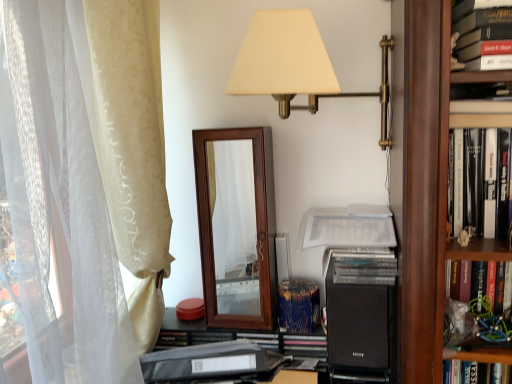
What do you see at coordinates (244, 338) in the screenshot? The width and height of the screenshot is (512, 384). I see `black plastic folder at lower center` at bounding box center [244, 338].

Identify the location of beige satin curtain at left. (85, 175).

The width and height of the screenshot is (512, 384). What do you see at coordinates (85, 175) in the screenshot? I see `beige satin curtain at left` at bounding box center [85, 175].

Find the location of a particular element. This screenshot has width=512, height=384. white paper at center is located at coordinates (347, 227).

Find the location of a particular element. The width and height of the screenshot is (512, 384). speaker below the hardcover book at right, the second book when ordered from top to bottom (from a real-world perspective) is located at coordinates [x=360, y=328].

From the image's perspective, which one is positioned higher, hardcover book at right, which is counted as the 1th book, starting from the bottom, or black matte speaker at center?

hardcover book at right, which is counted as the 1th book, starting from the bottom, appears higher in the image.

Considering the positions of objects hardcover book at right, the second book when ordered from top to bottom, and black matte speaker at center in the image provided, who is in front, hardcover book at right, the second book when ordered from top to bottom, or black matte speaker at center?

hardcover book at right, the second book when ordered from top to bottom, is more forward.

How different are the orientations of hardcover book at right, marked as the second book in a front-to-back arrangement, and black matte speaker at center in degrees?

There is a 2.75-degree angle between the facing directions of hardcover book at right, marked as the second book in a front-to-back arrangement, and black matte speaker at center.

Between wooden mirror at center and hardcover book at upper right, placed as the first book when sorted from top to bottom, which one has larger width?

Wider between the two is wooden mirror at center.

Can you tell me how much wooden mirror at center and hardcover book at upper right, placed as the first book when sorted from top to bottom, differ in facing direction?

The facing directions of wooden mirror at center and hardcover book at upper right, placed as the first book when sorted from top to bottom, are 1.38 degrees apart.

From the picture: Considering the relative sizes of wooden mirror at center and hardcover book at upper right, the second book in the bottom-to-top sequence, in the image provided, is wooden mirror at center shorter than hardcover book at upper right, the second book in the bottom-to-top sequence,?

Incorrect, the height of wooden mirror at center does not fall short of that of hardcover book at upper right, the second book in the bottom-to-top sequence.

Does wooden mirror at center lie in front of hardcover book at upper right, marked as the first book in a front-to-back arrangement?

No, it is behind hardcover book at upper right, marked as the first book in a front-to-back arrangement.

Looking at this image, which object is wider, hardcover book at upper right, the 2th book viewed from the back, or hardcover book at right, marked as the second book in a front-to-back arrangement?

A: hardcover book at right, marked as the second book in a front-to-back arrangement.

Based on their sizes in the image, would you say hardcover book at upper right, placed as the first book when sorted from top to bottom, is bigger or smaller than hardcover book at right, the second book when ordered from top to bottom?

In the image, hardcover book at upper right, placed as the first book when sorted from top to bottom, appears to be larger than hardcover book at right, the second book when ordered from top to bottom.

Consider the image. Considering the relative positions of hardcover book at upper right, the 2th book viewed from the back, and hardcover book at right, which is counted as the 1th book, starting from the bottom, in the image provided, is hardcover book at upper right, the 2th book viewed from the back, in front of hardcover book at right, which is counted as the 1th book, starting from the bottom,?

Yes, hardcover book at upper right, the 2th book viewed from the back, is in front of hardcover book at right, which is counted as the 1th book, starting from the bottom.

Can you confirm if hardcover book at upper right, placed as the first book when sorted from top to bottom, is taller than hardcover book at right, the second book when ordered from top to bottom?

Correct, hardcover book at upper right, placed as the first book when sorted from top to bottom, is much taller as hardcover book at right, the second book when ordered from top to bottom.

Is beige satin curtain at left not within wooden mirror at center?

Yes, beige satin curtain at left is located beyond the bounds of wooden mirror at center.

What's the angular difference between beige satin curtain at left and wooden mirror at center's facing directions?

There is a 96.7-degree angle between the facing directions of beige satin curtain at left and wooden mirror at center.

Is there a large distance between beige satin curtain at left and wooden mirror at center?

They are positioned close to each other.

From a real-world perspective, is wooden mirror at center located beneath beige satin curtain at left?

Yes, from a real-world perspective, wooden mirror at center is under beige satin curtain at left.

In the scene shown: Is wooden mirror at center positioned in front of beige satin curtain at left?

No, wooden mirror at center is behind beige satin curtain at left.

Does wooden mirror at center have a larger size compared to beige satin curtain at left?

No.

Identify the location of mirror on the right of beige satin curtain at left. The height and width of the screenshot is (384, 512). (237, 226).

From a real-world perspective, is white paper at center positioned under wooden mirror at center based on gravity?

No, from a real-world perspective, white paper at center is not under wooden mirror at center.

Is white paper at center facing towards wooden mirror at center?

No, white paper at center is not turned towards wooden mirror at center.

Does white paper at center have a greater height compared to wooden mirror at center?

No.

From the image's perspective, is white paper at center above beige satin curtain at left?

No.

Based on the photo, what's the angular difference between white paper at center and beige satin curtain at left's facing directions?

The angle between the facing direction of white paper at center and the facing direction of beige satin curtain at left is 97.3 degrees.

Who is more distant, white paper at center or beige satin curtain at left?

white paper at center is more distant.

In the image, there is a hardcover book at right, which is counted as the 1th book, starting from the bottom. Where is `speaker below it (from the image's perspective)`? This screenshot has height=384, width=512. speaker below it (from the image's perspective) is located at coordinates (360, 328).

Find the location of a particular element. The width and height of the screenshot is (512, 384). mirror located on the left of hardcover book at upper right, placed as the first book when sorted from top to bottom is located at coordinates (237, 226).

Looking at this image, when comparing their distances from black matte speaker at center, does black plastic folder at lower center or white paper at center seem closer?

white paper at center is closer to black matte speaker at center.

Based on their spatial positions, is beige satin curtain at left or hardcover book at upper right, the 2th book viewed from the back, closer to hardcover book at right, which is counted as the 1th book, starting from the bottom?

The object closer to hardcover book at right, which is counted as the 1th book, starting from the bottom, is hardcover book at upper right, the 2th book viewed from the back.

From the image, which object appears to be nearer to white paper at center, black plastic folder at lower center or wooden mirror at center?

wooden mirror at center is closer to white paper at center.

Which object lies further to the anchor point hardcover book at right, which is counted as the 1th book, starting from the bottom, white paper at center or matte gold lamp at upper center?

matte gold lamp at upper center lies further to hardcover book at right, which is counted as the 1th book, starting from the bottom, than the other object.

From the image, which object appears to be farther from hardcover book at right, marked as the second book in a front-to-back arrangement, black plastic folder at lower center or hardcover book at upper right, the second book in the bottom-to-top sequence?

black plastic folder at lower center is further to hardcover book at right, marked as the second book in a front-to-back arrangement.

Considering their positions, is hardcover book at right, the second book when ordered from top to bottom, positioned further to hardcover book at upper right, the 2th book viewed from the back, than wooden mirror at center?

Among the two, wooden mirror at center is located further to hardcover book at upper right, the 2th book viewed from the back.

Considering their positions, is hardcover book at upper right, the second book in the bottom-to-top sequence, positioned closer to black plastic folder at lower center than white paper at center?

Among the two, white paper at center is located nearer to black plastic folder at lower center.

Considering their positions, is wooden mirror at center positioned closer to hardcover book at upper right, the second book in the bottom-to-top sequence, than beige satin curtain at left?

wooden mirror at center is positioned closer to the anchor hardcover book at upper right, the second book in the bottom-to-top sequence.

Locate an element on the screen. The height and width of the screenshot is (384, 512). mirror between beige satin curtain at left and black matte speaker at center from left to right is located at coordinates click(x=237, y=226).

You are a GUI agent. You are given a task and a screenshot of the screen. Output one action in this format:
    pyautogui.click(x=<x>, y=<y>)
    Task: Click on the mirror between beige satin curtain at left and white paper at center from left to right
    This screenshot has height=384, width=512.
    Given the screenshot: What is the action you would take?
    pyautogui.click(x=237, y=226)

This screenshot has width=512, height=384. I want to click on speaker that lies between matte gold lamp at upper center and black plastic folder at lower center from top to bottom, so click(360, 328).

At what (x,y) coordinates should I click in order to perform the action: click on lamp located between beige satin curtain at left and hardcover book at right, marked as the second book in a front-to-back arrangement, in the left-right direction. Please return your answer as a coordinate pair (x, y). The height and width of the screenshot is (384, 512). Looking at the image, I should click on coord(295,64).